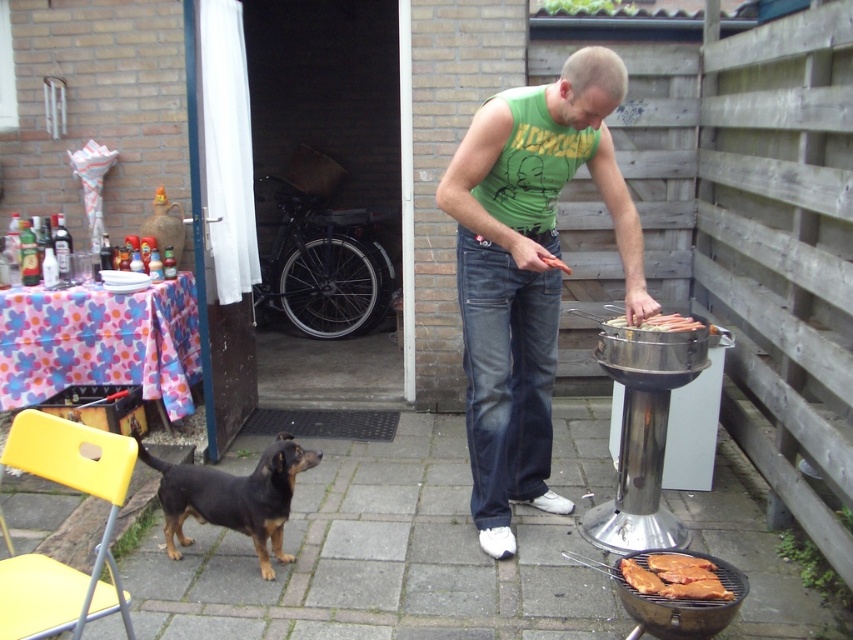
Consider the image. You are a guest at a barbecue and want to sit down while waiting for the brown textured meat at lower center to cook. Is the yellow plastic chair at lower left a good option?

The yellow plastic chair at lower left is positioned over the brown textured meat at lower center, so sitting there would block access to the meat. Choose another seat.

Please look at the image and tell me the exact 2D coordinates of the brown textured meat at lower center in the image. The coordinates should be in the format of a point like this example format, for instance, point A is at point 0.300, 0.400. Please answer with the coordinates in the same format as the example.

The brown textured meat at lower center is located at point [674,577].